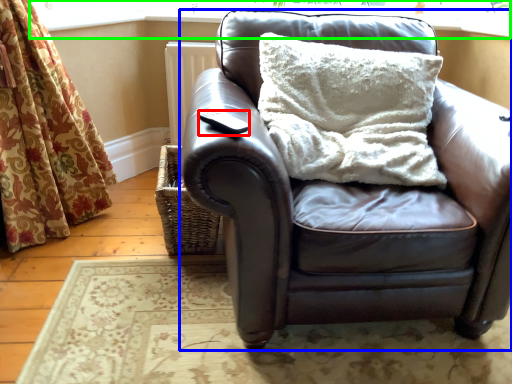
Question: Which object is positioned closest to pad (highlighted by a red box)? Select from studio couch (highlighted by a blue box) and window frame (highlighted by a green box).

Choices:
 (A) studio couch
 (B) window frame

Answer: (A)